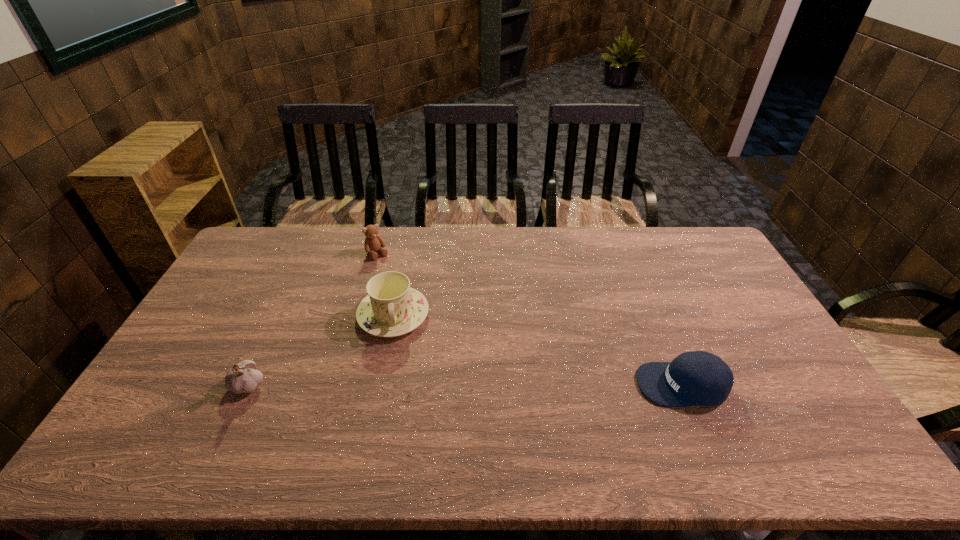
Find the location of `free spot on the desktop that is between the leftmost object and the baseball cap and is positioned on the front-facing side of the farthest object`. free spot on the desktop that is between the leftmost object and the baseball cap and is positioned on the front-facing side of the farthest object is located at coordinates (476, 384).

Image resolution: width=960 pixels, height=540 pixels. Identify the location of free spot on the desktop that is between the leftmost object and the shortest object and is positioned on the handle side of the chinaware. (400, 384).